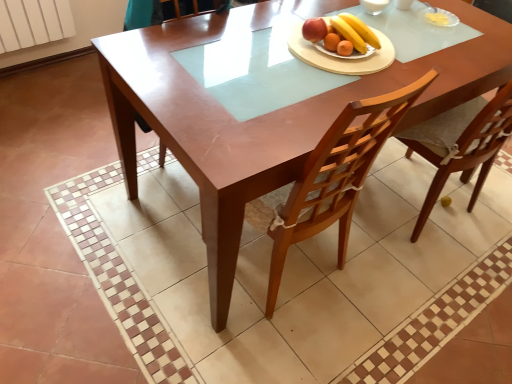
Question: Does shiny white plate with fruits at center have a greater height compared to wooden table at center?

Choices:
 (A) yes
 (B) no

Answer: (B)

Question: Is shiny white plate with fruits at center turned away from wooden table at center?

Choices:
 (A) yes
 (B) no

Answer: (B)

Question: Considering the relative sizes of shiny white plate with fruits at center and wooden table at center in the image provided, is shiny white plate with fruits at center shorter than wooden table at center?

Choices:
 (A) no
 (B) yes

Answer: (B)

Question: Can you confirm if shiny white plate with fruits at center is thinner than wooden table at center?

Choices:
 (A) yes
 (B) no

Answer: (A)

Question: From the image's perspective, is shiny white plate with fruits at center under wooden table at center?

Choices:
 (A) yes
 (B) no

Answer: (B)

Question: Is shiny white plate with fruits at center closer to camera compared to wooden table at center?

Choices:
 (A) yes
 (B) no

Answer: (B)

Question: Is the position of wooden table at center more distant than that of shiny white plate with fruits at center?

Choices:
 (A) yes
 (B) no

Answer: (B)

Question: From a real-world perspective, is wooden table at center physically below shiny white plate with fruits at center?

Choices:
 (A) no
 (B) yes

Answer: (B)

Question: Is wooden table at center facing towards shiny white plate with fruits at center?

Choices:
 (A) yes
 (B) no

Answer: (B)

Question: Is the surface of wooden table at center in direct contact with shiny white plate with fruits at center?

Choices:
 (A) no
 (B) yes

Answer: (A)

Question: Is wooden table at center at the left side of shiny white plate with fruits at center?

Choices:
 (A) no
 (B) yes

Answer: (B)

Question: Is wooden table at center looking in the opposite direction of shiny white plate with fruits at center?

Choices:
 (A) yes
 (B) no

Answer: (B)

Question: Based on their sizes in the image, would you say shiny white plate with fruits at center is bigger or smaller than wooden table at center?

Choices:
 (A) small
 (B) big

Answer: (A)